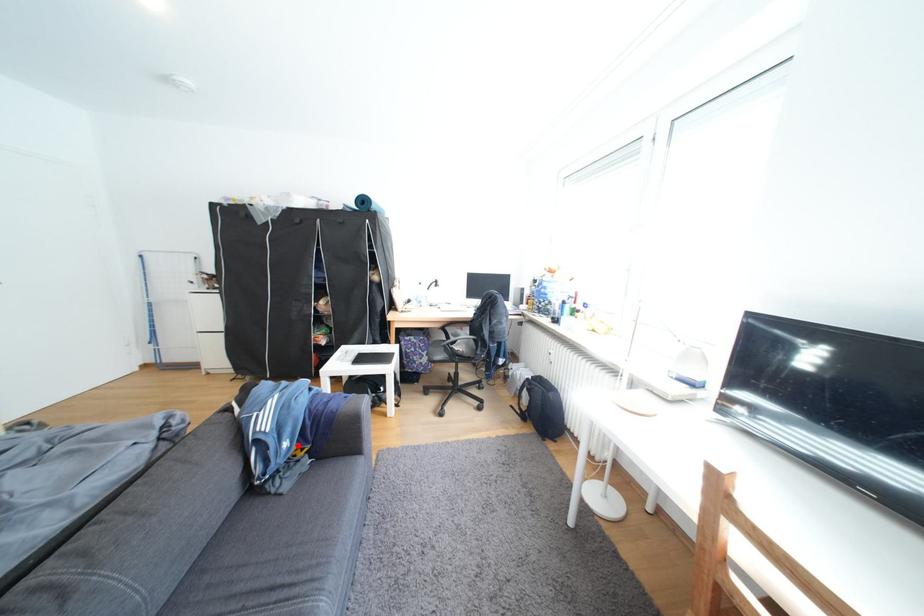
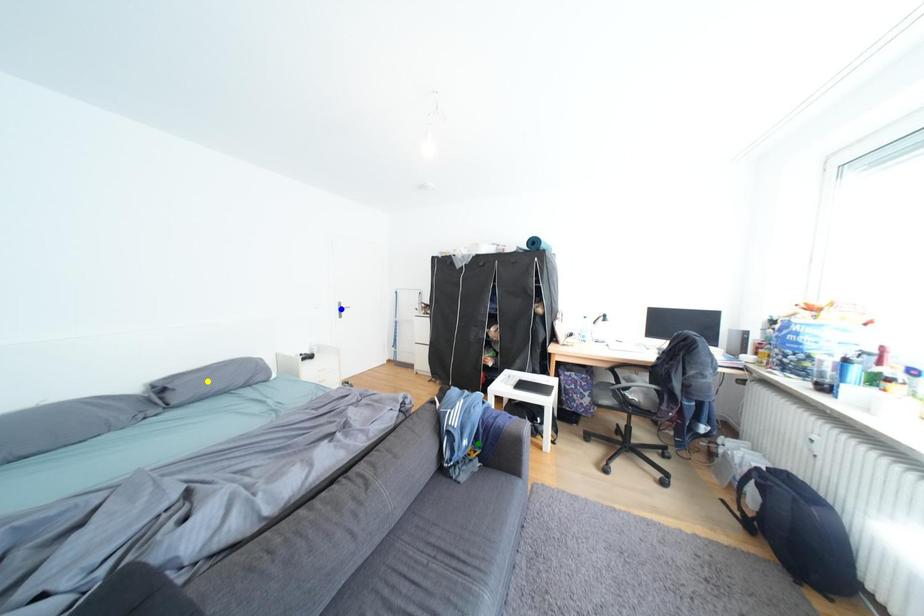
Question: I am providing you with two images of the same scene from different viewpoints. A red point is marked on the first image. You are given multiple points on the second image. Which point in image 2 represents the same 3d spot as the red point in image 1?

Choices:
 (A) green point
 (B) blue point
 (C) yellow point

Answer: (A)